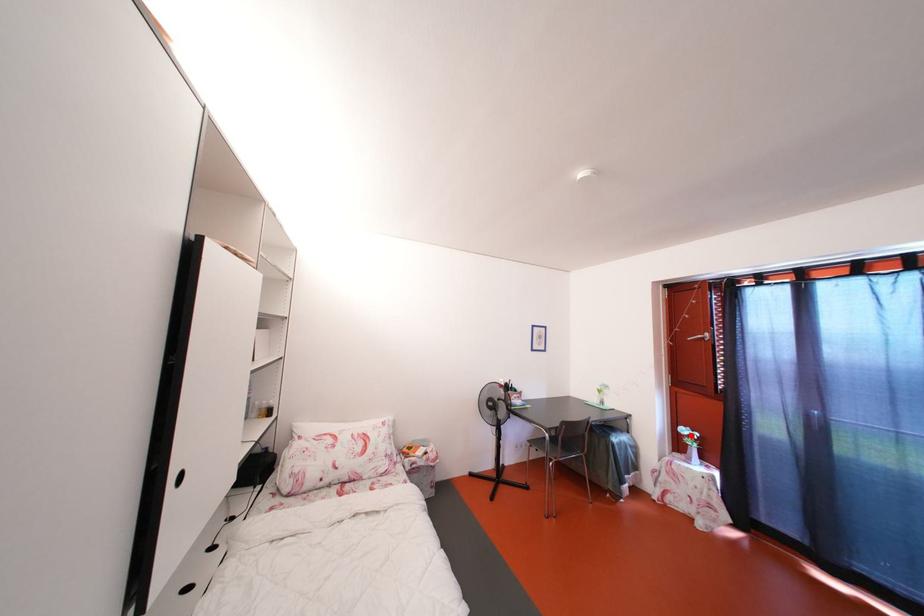
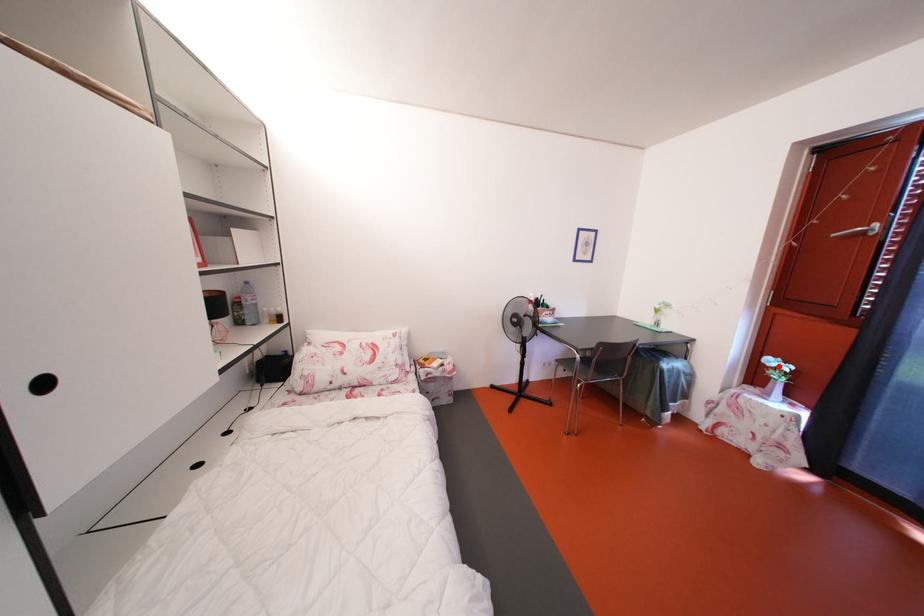
I am providing you with two images of the same scene from different viewpoints. A red point is marked on the first image and another point is marked on the second image. Is the red point in image1 aligned with the point shown in image2?

Yes